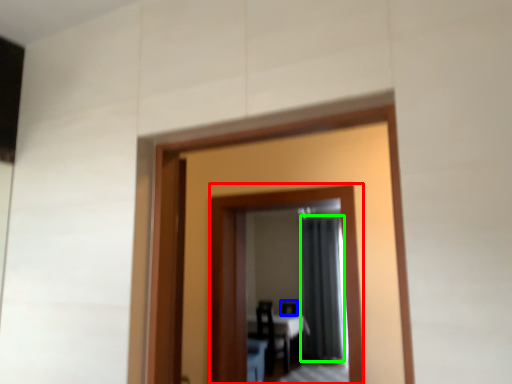
Question: Which object is positioned farthest from mirror (highlighted by a red box)? Select from chair (highlighted by a blue box) and curtain (highlighted by a green box).

Choices:
 (A) chair
 (B) curtain

Answer: (A)